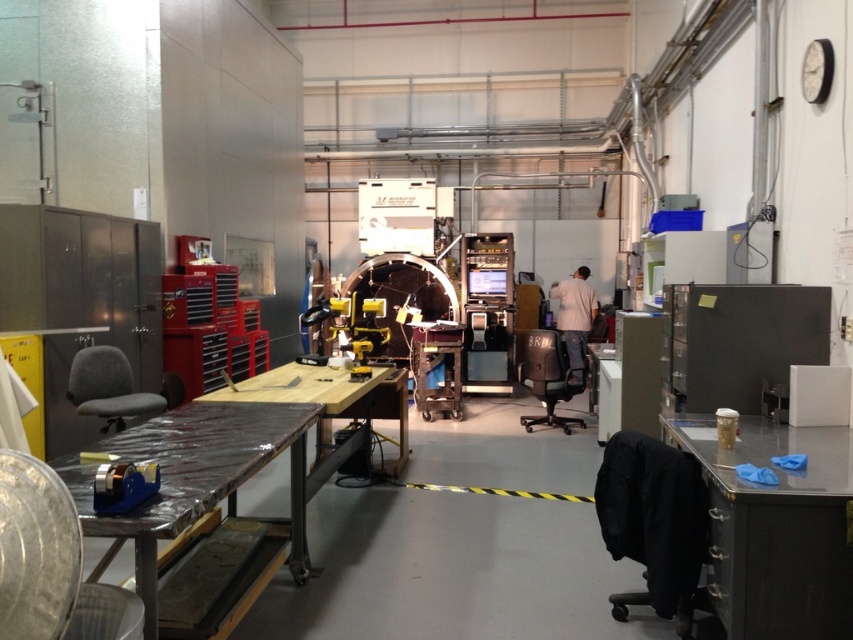
You are an inspector in the workshop and need to check the gray matte workbench at lower right and the light beige shirt at center. Which object is closer to you?

The gray matte workbench at lower right is closer to you because it is in front of the light beige shirt at center.